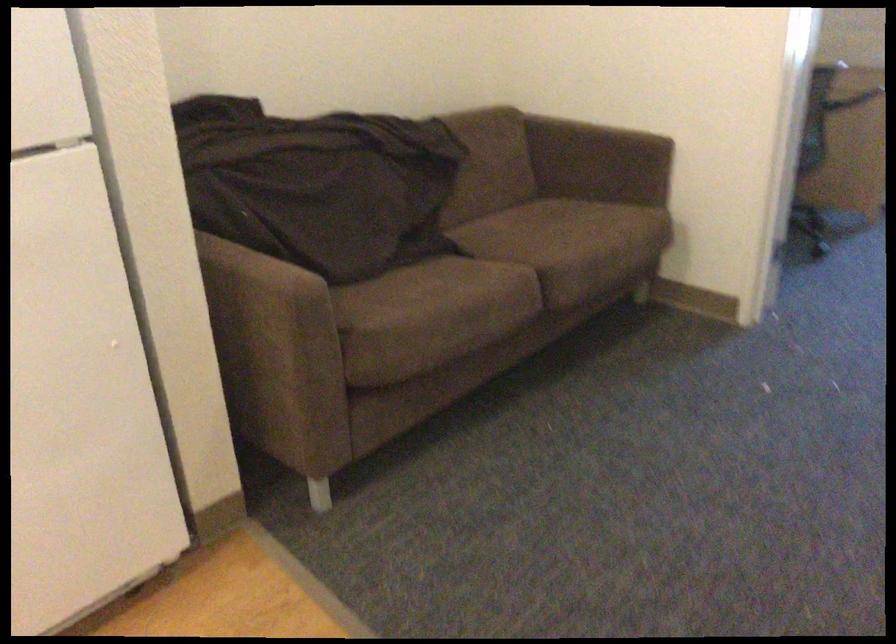
Based on the continuous images, in which direction is the camera rotating?

The camera's rotation is toward left-down.